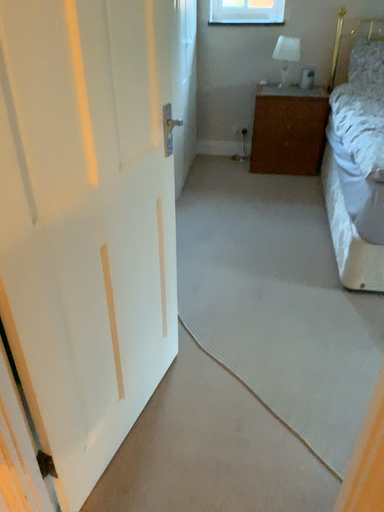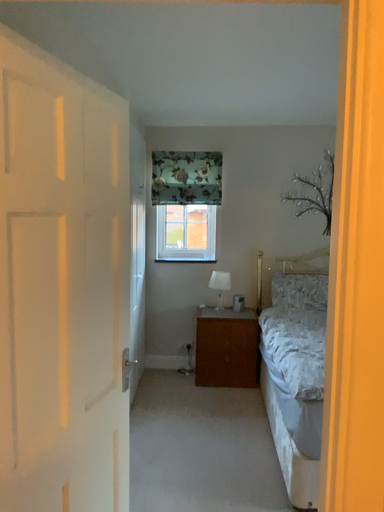
Question: Which way did the camera rotate in the video?

Choices:
 (A) rotated right
 (B) rotated left

Answer: (A)